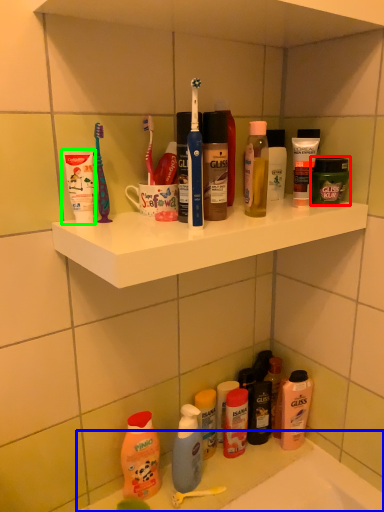
Question: Considering the real-world distances, which object is closest to toiletry (highlighted by a red box)? counter (highlighted by a blue box) or toiletry (highlighted by a green box).

Choices:
 (A) counter
 (B) toiletry

Answer: (B)